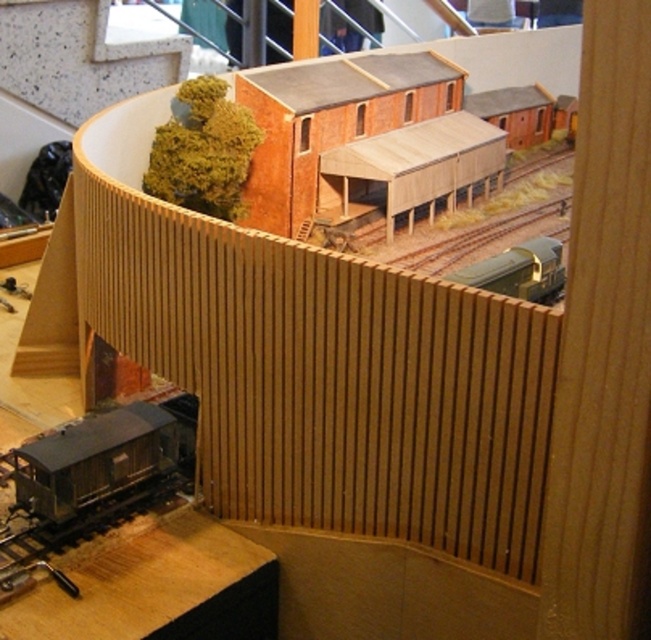
You are a model train enthusiast observing the model railway setup. You notice the metallic gray train car at lower left and the metallic gold train at center. Which train is closer to you?

The metallic gray train car at lower left is closer to you because it is positioned in front of the metallic gold train at center.

In the scene shown: You are a model railway enthusiast observing the setup. You notice the metallic gray train car at lower left and the metallic gold train at center. Which train is positioned further to the left side of the scene?

The metallic gray train car at lower left is positioned further to the left side of the scene because it is to the left of the metallic gold train at center.